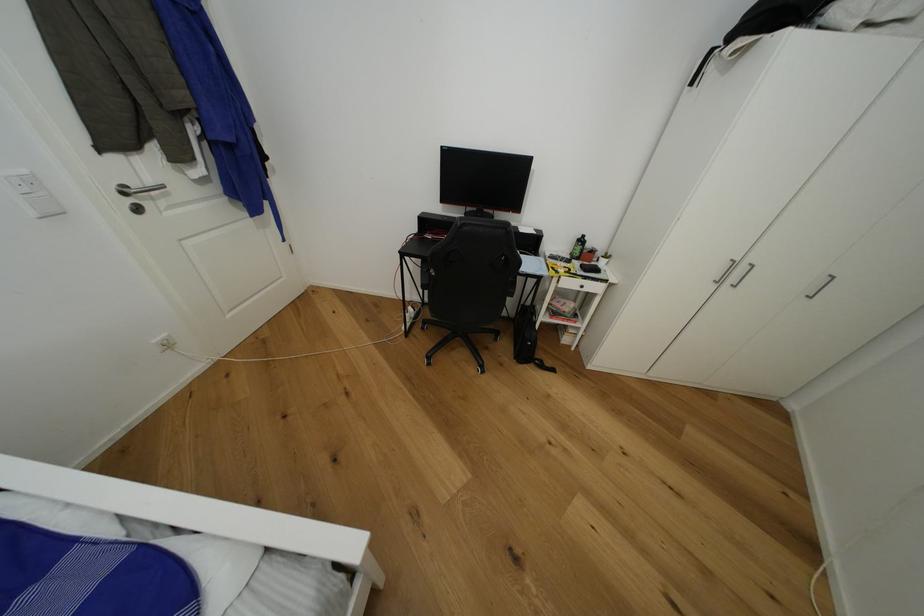
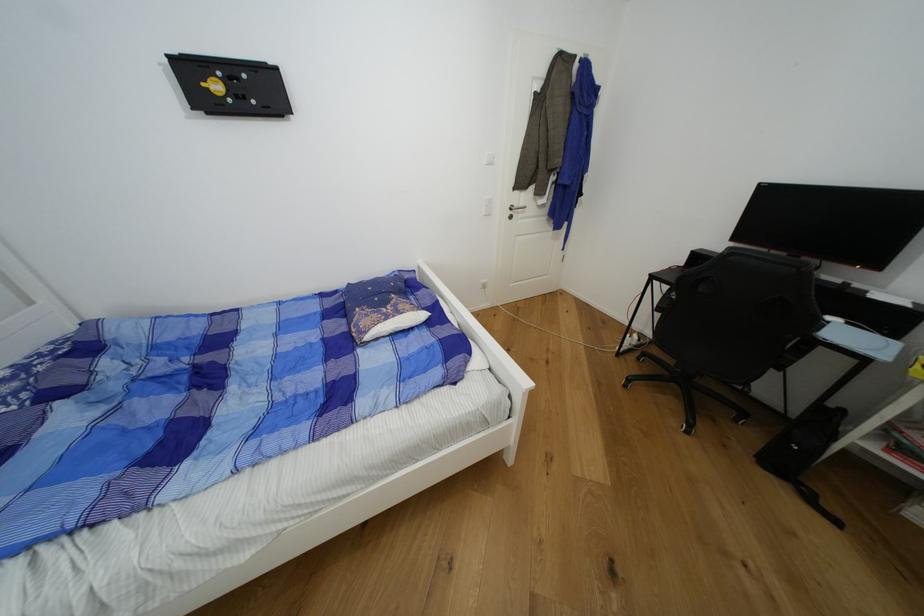
The point at (x=532, y=313) is marked in the first image. Where is the corresponding point in the second image?

(833, 418)